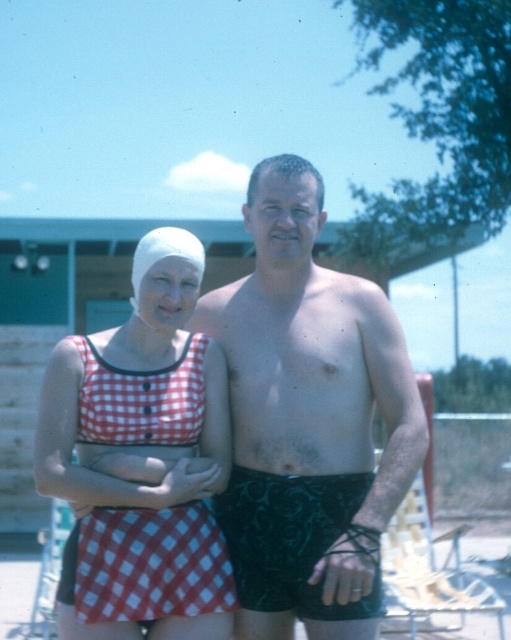
Is red checkered fabric at lower left below wooden slats beach chair at lower right?

No.

Is point (77, 586) positioned before point (403, 528)?

Yes, it is.

Identify the location of red checkered fabric at lower left. (150, 564).

Who is lower down, dark green textured shorts at center or red checkered fabric at lower left?

red checkered fabric at lower left

Is dark green textured shorts at center positioned in front of red checkered fabric at lower left?

That is True.

What do you see at coordinates (309, 420) in the screenshot? Image resolution: width=511 pixels, height=640 pixels. I see `dark green textured shorts at center` at bounding box center [309, 420].

The image size is (511, 640). Identify the location of dark green textured shorts at center. (309, 420).

Is red checkered swimsuit at center positioned before wooden slats beach chair at lower right?

Yes, red checkered swimsuit at center is in front of wooden slats beach chair at lower right.

Is red checkered swimsuit at center bigger than wooden slats beach chair at lower right?

No, red checkered swimsuit at center is not bigger than wooden slats beach chair at lower right.

Does point (102, 572) lie behind point (404, 550)?

No, (102, 572) is in front of (404, 550).

Locate an element on the screen. red checkered swimsuit at center is located at coordinates (143, 458).